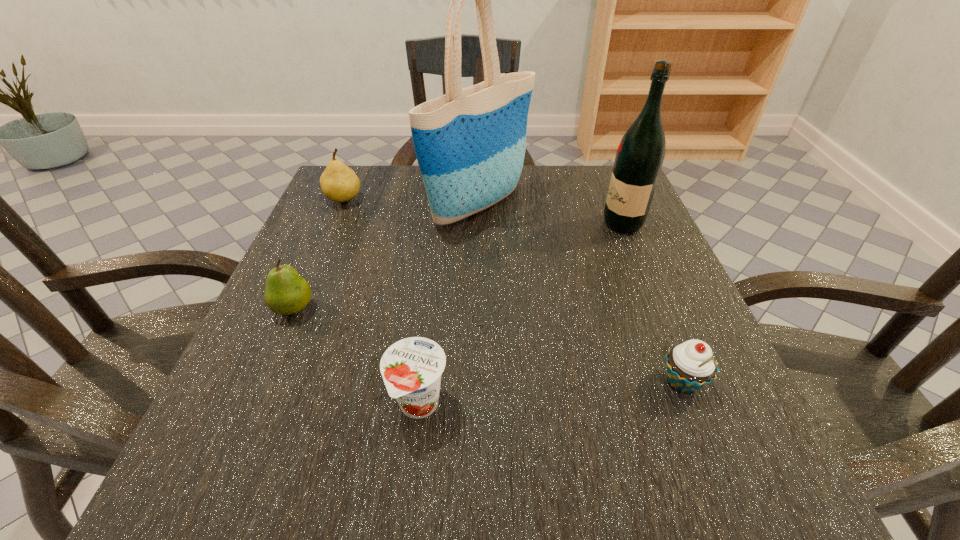
I want to click on free spot between the fifth shortest object and the cupcake, so click(x=653, y=303).

In order to click on free space between the tallest object and the fifth shortest object in this screenshot , I will do `click(551, 215)`.

What are the coordinates of `unoccupied area between the liquor and the tallest object` in the screenshot? It's located at (551, 215).

Find the location of a particular element. This screenshot has width=960, height=540. free space between the cupcake and the tallest object is located at coordinates (581, 294).

The image size is (960, 540). I want to click on free spot between the cupcake and the yogurt, so click(551, 394).

Where is `free space between the cupcake and the yogurt`? The image size is (960, 540). free space between the cupcake and the yogurt is located at coordinates (551, 394).

Image resolution: width=960 pixels, height=540 pixels. What are the coordinates of `vacant space in between the liquor and the shorter pear` in the screenshot? It's located at (458, 266).

Find the location of a particular element. The width and height of the screenshot is (960, 540). empty location between the fifth shortest object and the cupcake is located at coordinates (653, 303).

Image resolution: width=960 pixels, height=540 pixels. Find the location of `vacant space in between the cupcake and the farther pear`. vacant space in between the cupcake and the farther pear is located at coordinates (514, 291).

What are the coordinates of `object that ranks as the fourth closest to the third nearest object` in the screenshot? It's located at (690, 366).